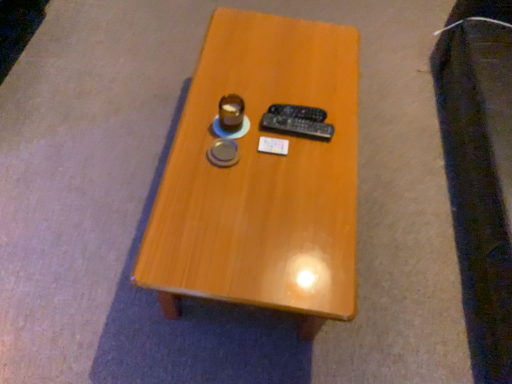
Where is `free space in front of black plastic remote control at center, marked as the second remote control in a front-to-back arrangement`? This screenshot has height=384, width=512. free space in front of black plastic remote control at center, marked as the second remote control in a front-to-back arrangement is located at coordinates (292, 164).